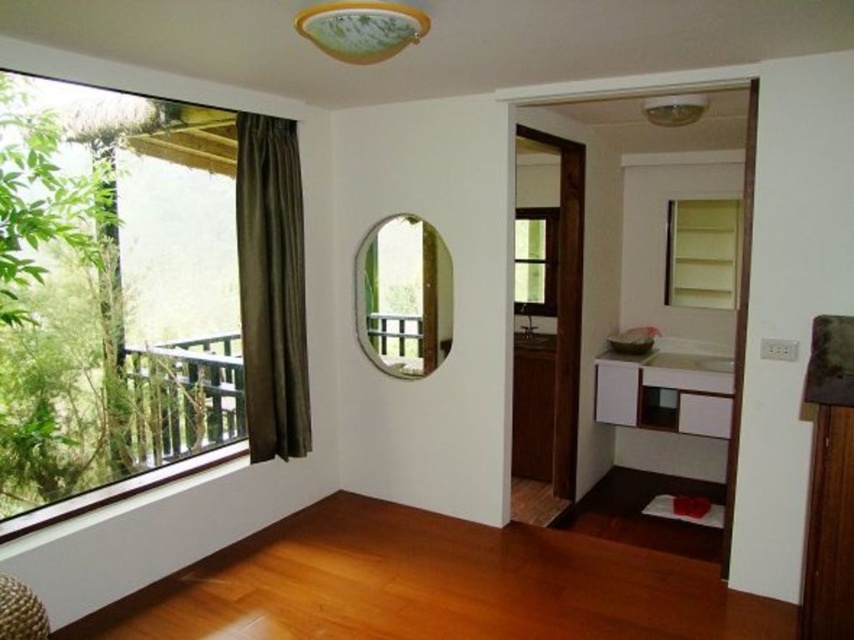
Does transparent glass window at left appear over green glass window at center?

No.

In the scene shown: Between transparent glass window at left and green glass window at center, which one appears on the left side from the viewer's perspective?

From the viewer's perspective, transparent glass window at left appears more on the left side.

Does point (3, 248) lie in front of point (545, 241)?

Yes, it is in front of point (545, 241).

Identify the location of transparent glass window at left. (112, 296).

Is green velvet curtain at left wider than clear glass mirror at center?

Incorrect, green velvet curtain at left's width does not surpass clear glass mirror at center's.

Is green velvet curtain at left shorter than clear glass mirror at center?

In fact, green velvet curtain at left may be taller than clear glass mirror at center.

Find the location of `green velvet curtain at left`. green velvet curtain at left is located at coordinates pyautogui.click(x=272, y=288).

Where is `green velvet curtain at left`? This screenshot has width=854, height=640. green velvet curtain at left is located at coordinates (272, 288).

Is transparent glass window at left bigger than green velvet curtain at left?

Indeed, transparent glass window at left has a larger size compared to green velvet curtain at left.

Between point (188, 465) and point (273, 445), which one is positioned in front?

Point (188, 465) is more forward.

Find the location of `transparent glass window at left`. transparent glass window at left is located at coordinates (112, 296).

Locate an element on the screen. This screenshot has width=854, height=640. transparent glass window at left is located at coordinates (112, 296).